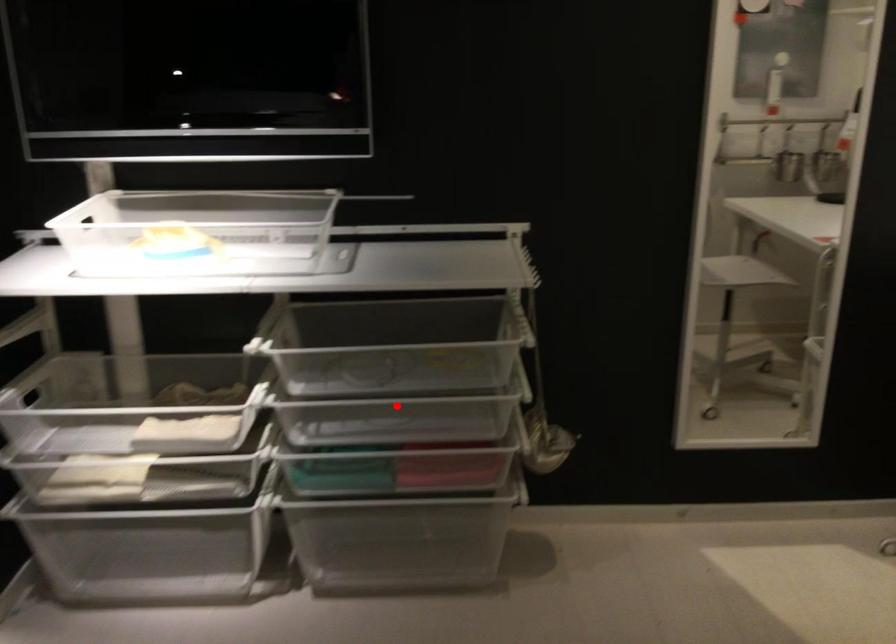
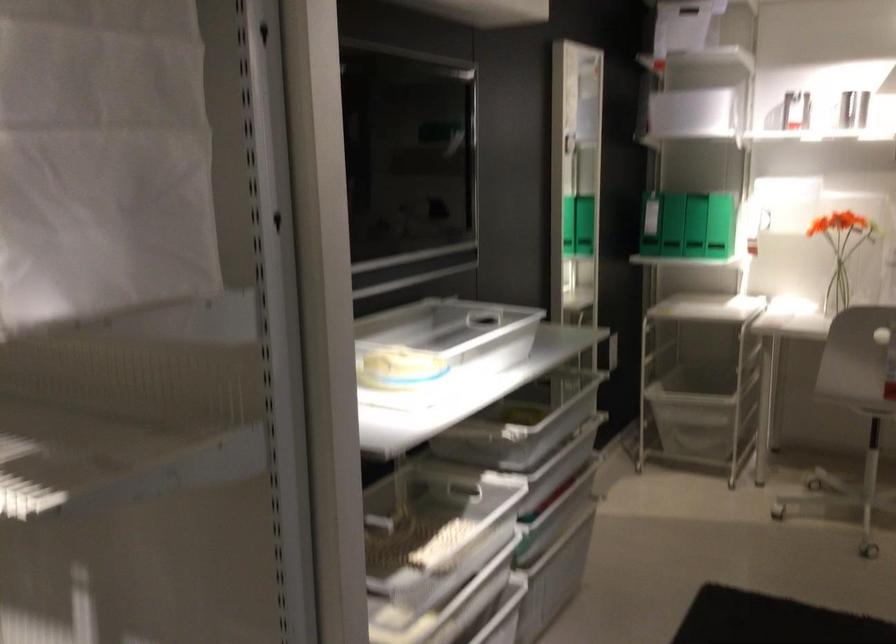
Question: I am providing you with two images of the same scene from different viewpoints. A red point is marked on the first image. Can you still see the location of the red point in image 2?

Choices:
 (A) Yes
 (B) No

Answer: (B)